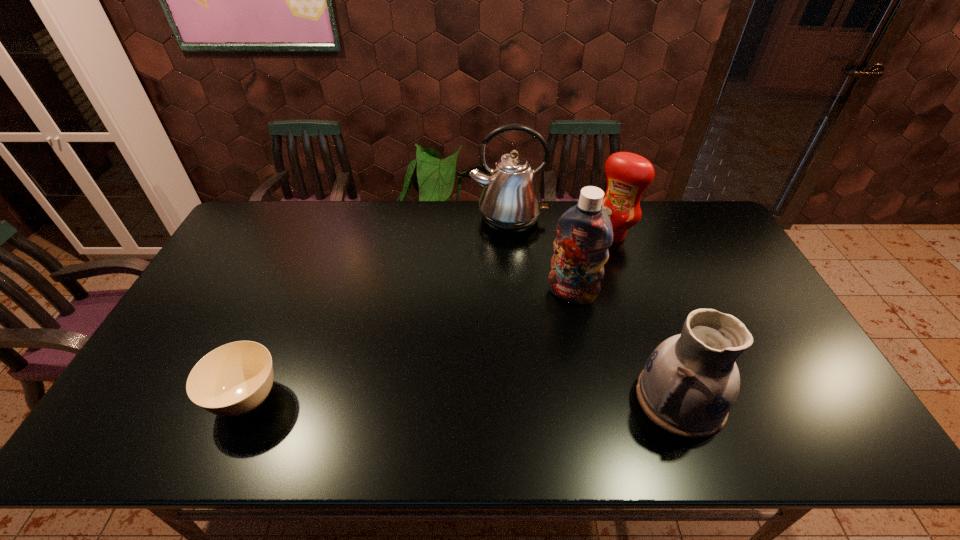
Locate an element on the screen. The width and height of the screenshot is (960, 540). free spot on the desktop that is between the leftmost object and the pottery and is positioned on the front label of the shampoo is located at coordinates point(524,399).

Locate an element on the screen. The width and height of the screenshot is (960, 540). vacant space on the desktop that is between the sugar bowl and the pottery and is positioned from the spout of the kettle is located at coordinates (508, 399).

Locate an element on the screen. free spot on the desktop that is between the sugar bowl and the pottery and is positioned on the label side of the condiment is located at coordinates (473, 399).